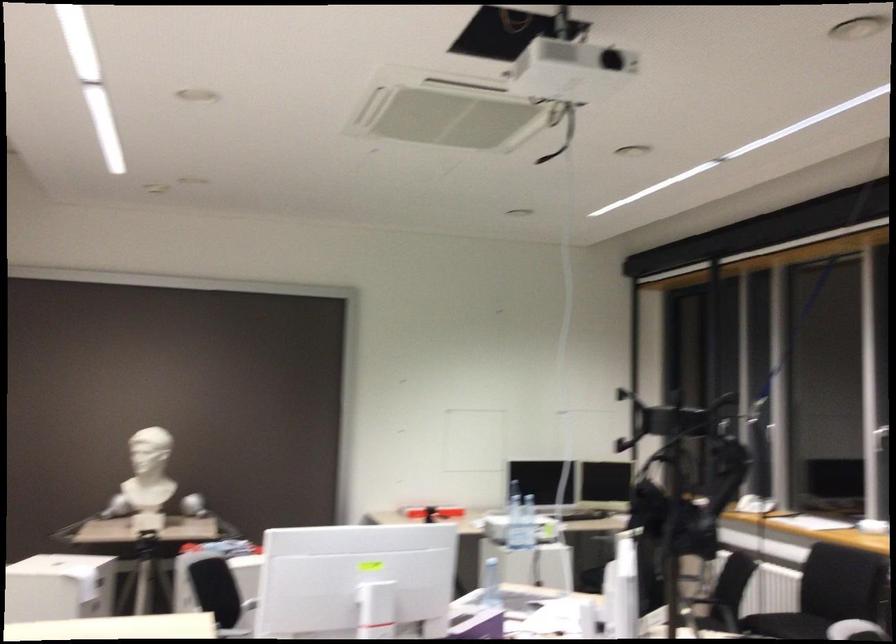
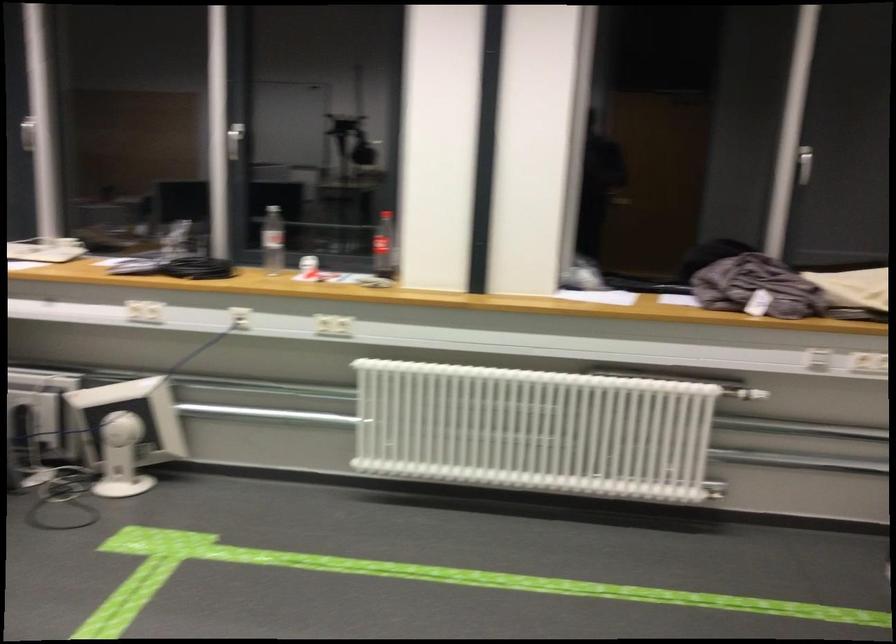
The images are taken continuously from a first-person perspective. In which direction is your viewpoint rotating?

The camera rotated toward right-down.